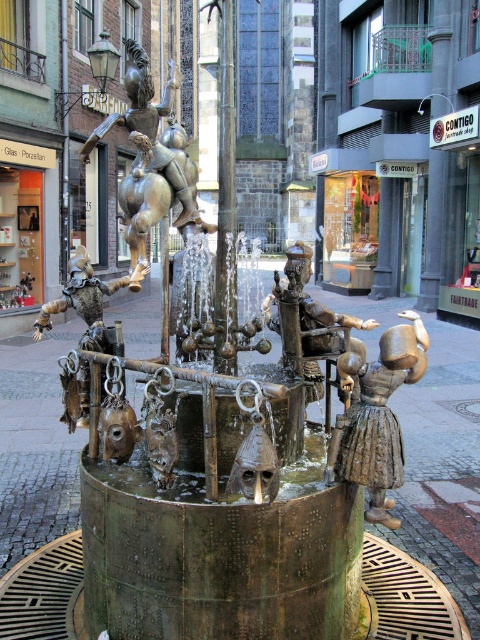
Question: Does bronze statue at upper center have a larger size compared to bronze figure at center?

Choices:
 (A) no
 (B) yes

Answer: (B)

Question: Is the position of bronze statue at upper center more distant than that of bronze figure at center?

Choices:
 (A) yes
 (B) no

Answer: (A)

Question: Which point is closer to the camera?

Choices:
 (A) (392, 380)
 (B) (148, 74)

Answer: (A)

Question: Is bronze statue at upper center above bronze figure at center?

Choices:
 (A) no
 (B) yes

Answer: (B)

Question: Which of the following is the closest to the observer?

Choices:
 (A) bronze figure at center
 (B) bronze statue at upper center

Answer: (A)